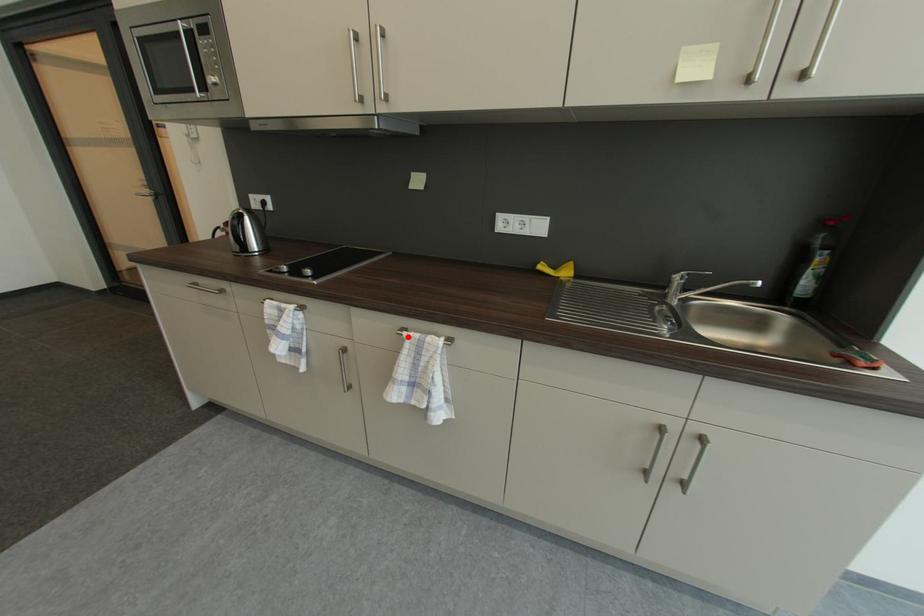
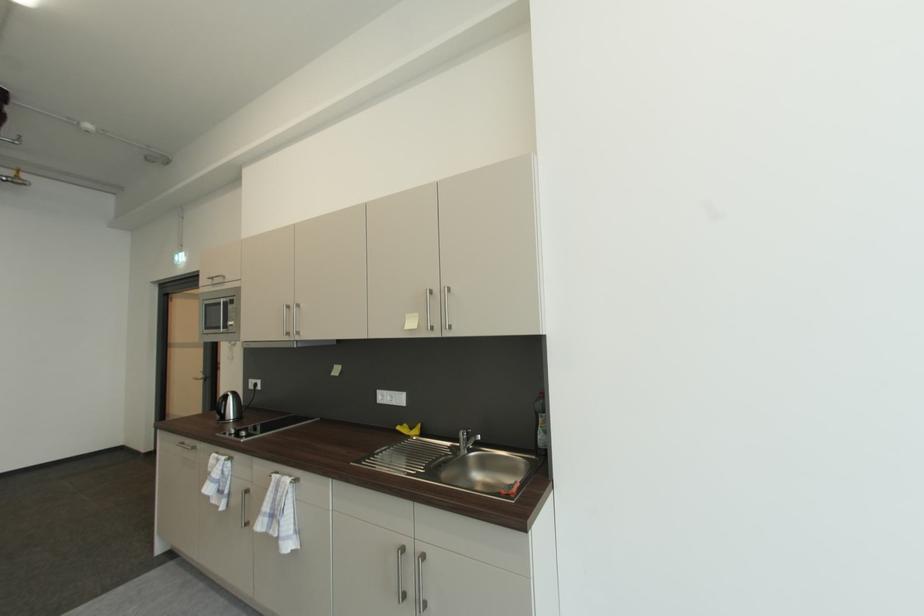
Locate, in the second image, the point that corresponds to the highlighted location in the first image.

(277, 477)